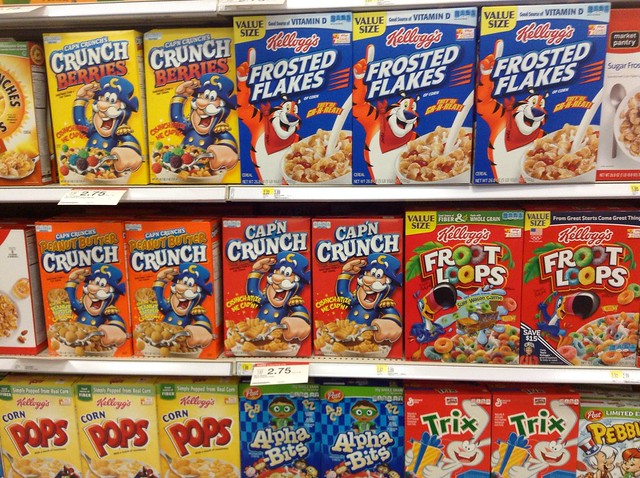
Identify the location of cereal boxes on topmost shelf. The height and width of the screenshot is (478, 640). pyautogui.click(x=20, y=126), pyautogui.click(x=88, y=120), pyautogui.click(x=175, y=118), pyautogui.click(x=282, y=106), pyautogui.click(x=429, y=96), pyautogui.click(x=516, y=91), pyautogui.click(x=624, y=92).